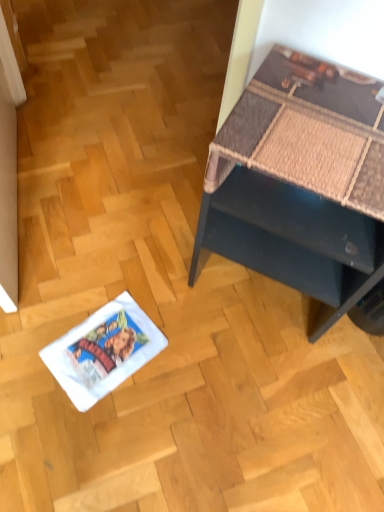
You are a GUI agent. You are given a task and a screenshot of the screen. Output one action in this format:
    pyautogui.click(x=<x>, y=<y>)
    Task: Click on the vacant space behind white paper comic book at lower left
    
    Given the screenshot: What is the action you would take?
    pyautogui.click(x=115, y=275)